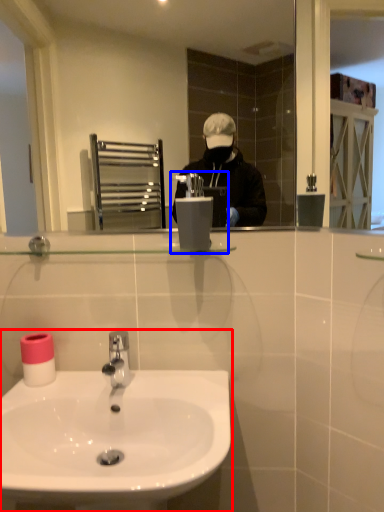
Question: Which object appears farthest to the camera in this image, sink (highlighted by a red box) or hand dryer (highlighted by a blue box)?

Choices:
 (A) sink
 (B) hand dryer

Answer: (B)